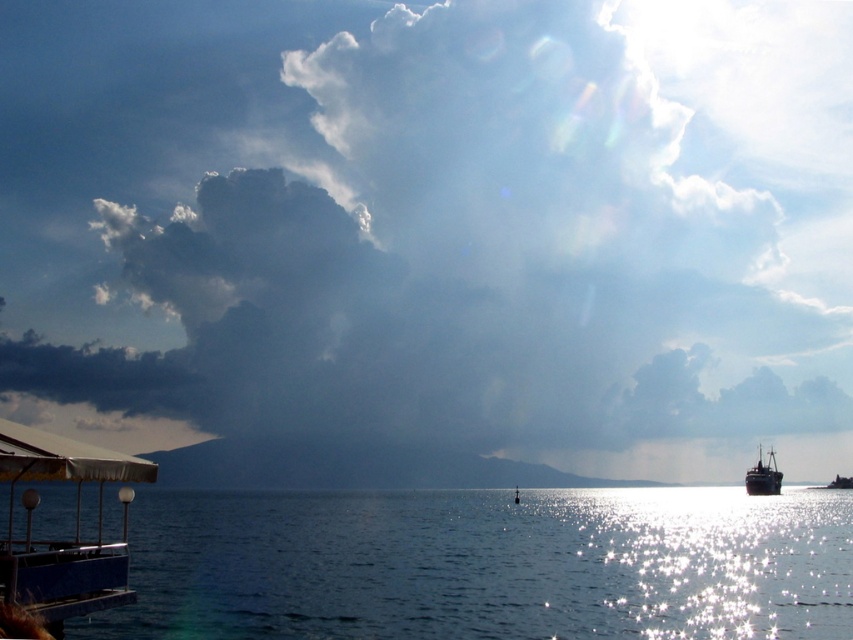
Question: Can you confirm if dark gray cloud at upper center is positioned to the right of white matte canopy at lower left?

Choices:
 (A) no
 (B) yes

Answer: (A)

Question: Among these points, which one is farthest from the camera?

Choices:
 (A) (299, 513)
 (B) (96, 556)
 (C) (778, 472)

Answer: (C)

Question: Is blue water at lower left closer to camera compared to shiny dark wood ship at right?

Choices:
 (A) yes
 (B) no

Answer: (A)

Question: Which point is farther to the camera?

Choices:
 (A) shiny dark wood ship at right
 (B) blue water at lower left
 (C) white matte canopy at lower left

Answer: (A)

Question: From the image, what is the correct spatial relationship of blue water at lower left in relation to shiny dark wood ship at right?

Choices:
 (A) right
 (B) left

Answer: (B)

Question: Which point is farther to the camera?

Choices:
 (A) (442, 380)
 (B) (596, 616)

Answer: (A)